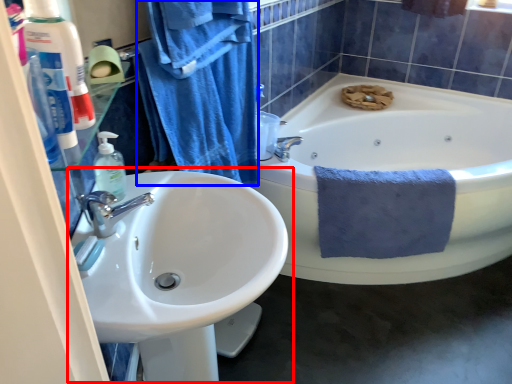
Question: Among these objects, which one is nearest to the camera, sink (highlighted by a red box) or bath towel (highlighted by a blue box)?

Choices:
 (A) sink
 (B) bath towel

Answer: (A)